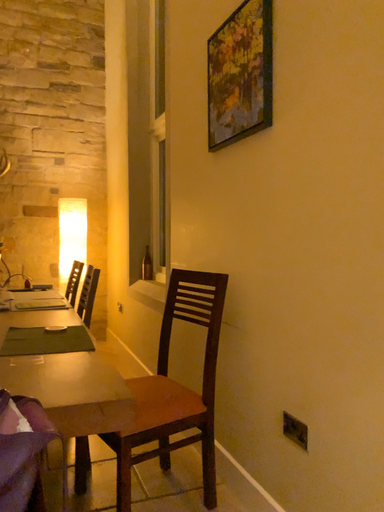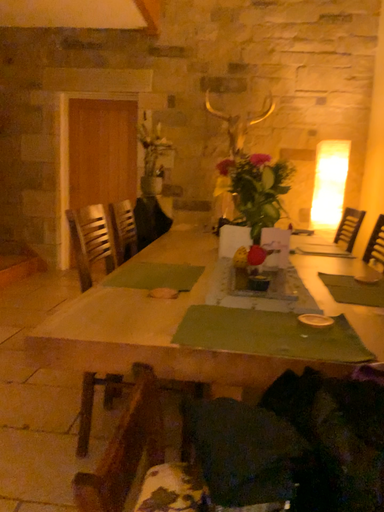
Question: Which way did the camera rotate in the video?

Choices:
 (A) rotated left
 (B) rotated right

Answer: (A)